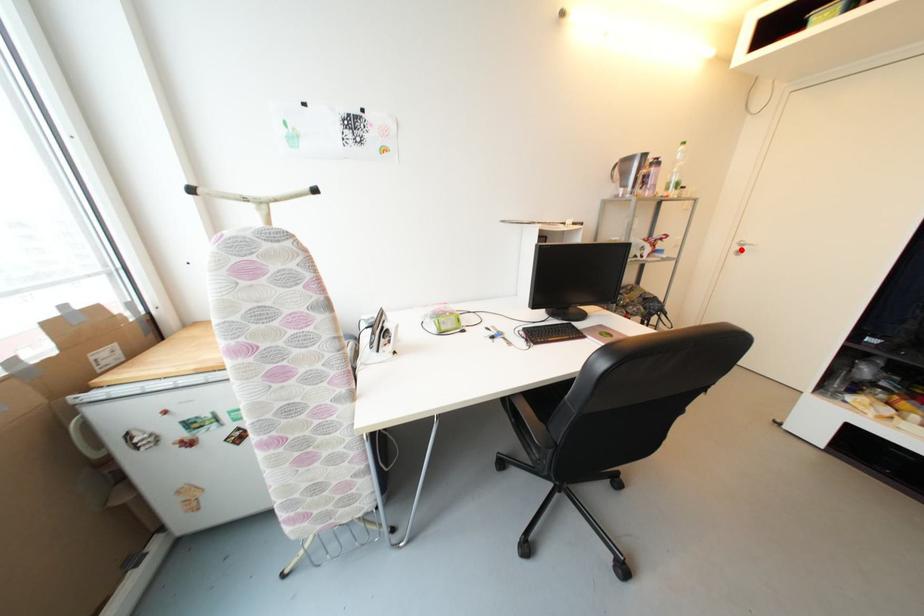
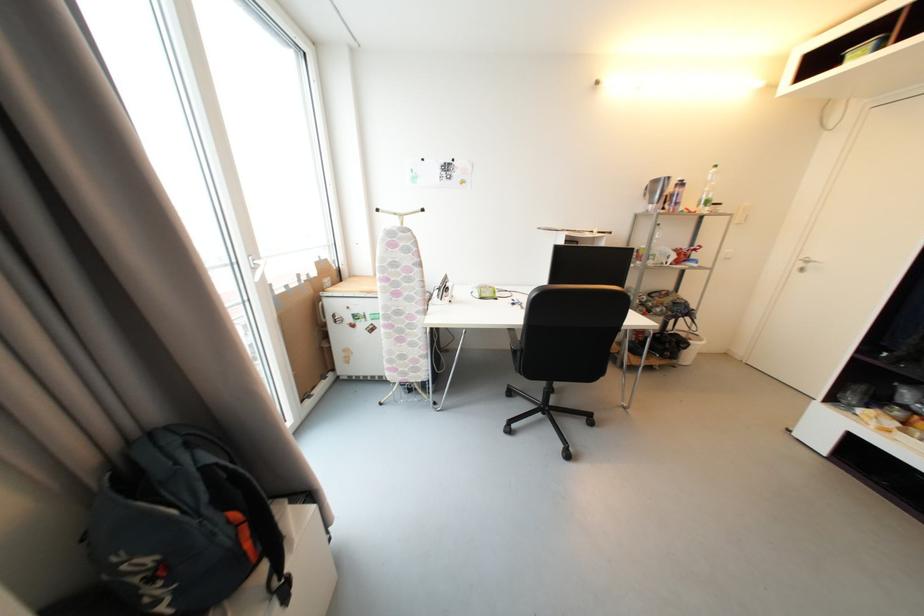
Where in the second image is the point corresponding to the highlighted location from the first image?

(806, 267)